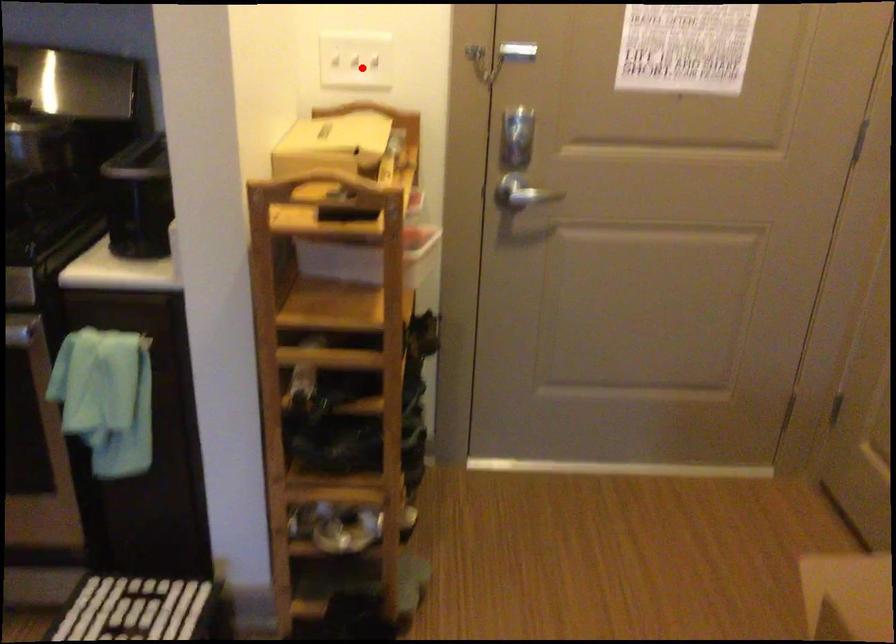
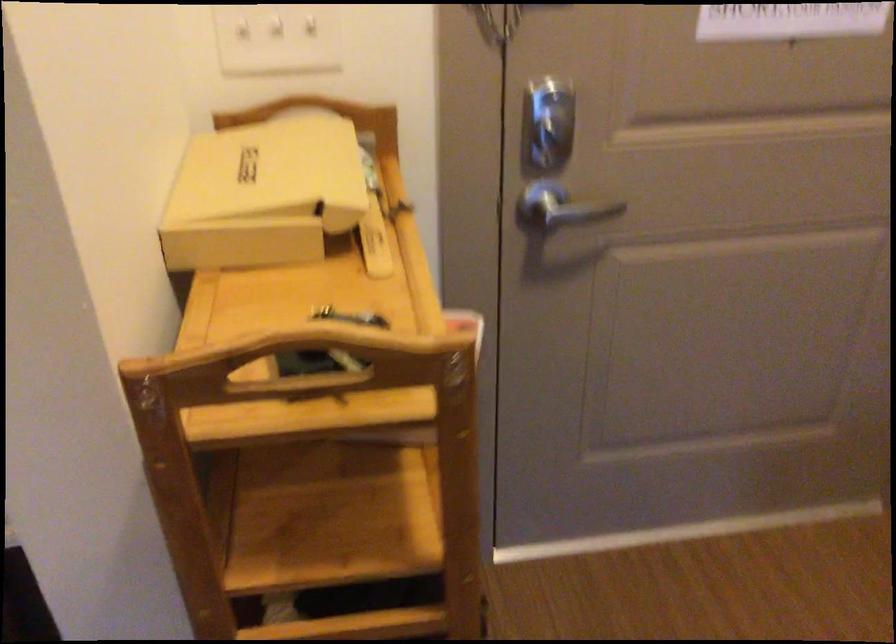
Locate, in the second image, the point that corresponds to the highlighted location in the first image.

(276, 39)